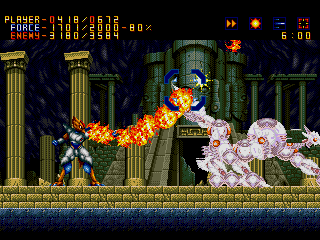
At what (x,y) coordinates should I click in order to perform the action: click on ceiling. Please return your answer as a coordinate pair (x, y). The height and width of the screenshot is (240, 320). Looking at the image, I should click on (278, 52), (128, 50).